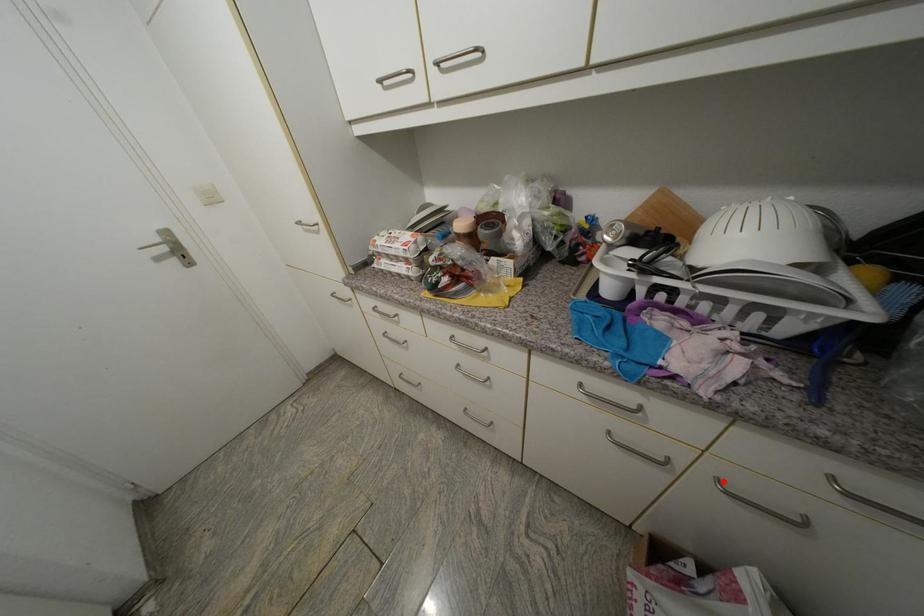
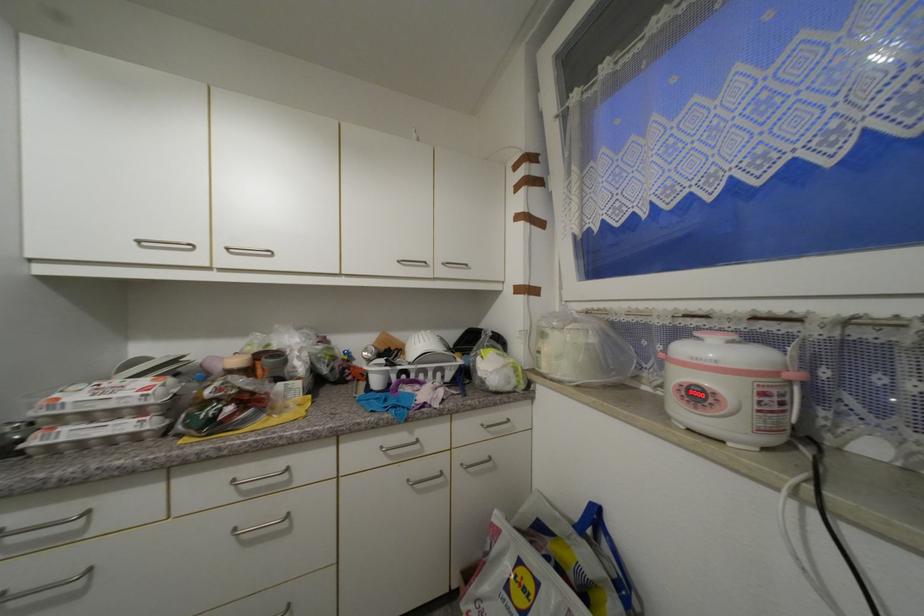
Find the pixel in the second image that matches the highlighted location in the first image.

(468, 467)